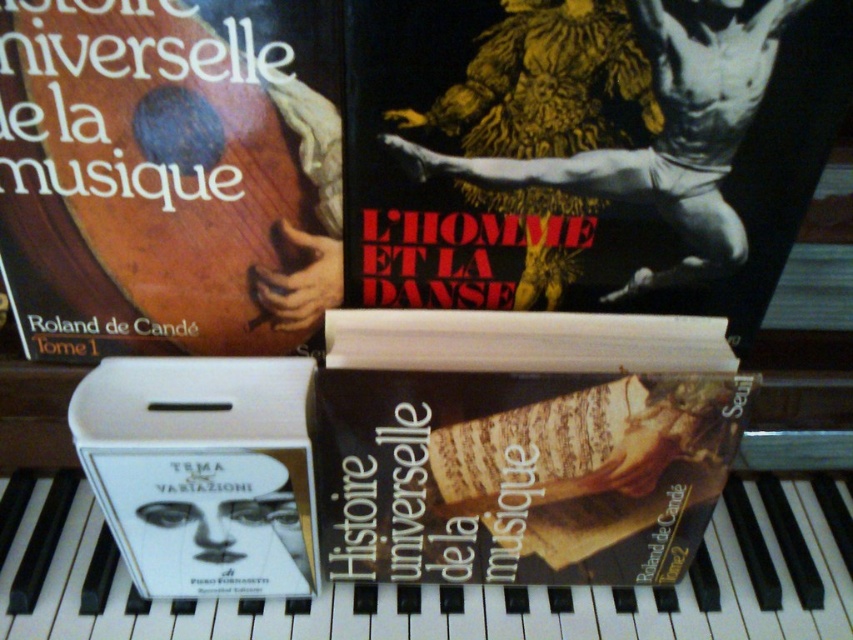
From the picture: Does wooden cover book at upper left have a lesser height compared to brown paperback book at center?

In fact, wooden cover book at upper left may be taller than brown paperback book at center.

Where is `wooden cover book at upper left`? The width and height of the screenshot is (853, 640). wooden cover book at upper left is located at coordinates (167, 173).

Is point (560, 422) positioned after point (56, 493)?

No, it is not.

Can you confirm if brown paperback book at center is thinner than white glossy piano keys at lower center?

Correct, brown paperback book at center's width is less than white glossy piano keys at lower center's.

Between point (358, 456) and point (488, 596), which one is positioned behind?

Positioned behind is point (488, 596).

Find the location of a particular element. brown paperback book at center is located at coordinates (519, 474).

I want to click on wooden cover book at upper left, so pyautogui.click(x=167, y=173).

Where is `wooden cover book at upper left`? Image resolution: width=853 pixels, height=640 pixels. wooden cover book at upper left is located at coordinates (167, 173).

What are the coordinates of `wooden cover book at upper left` in the screenshot? It's located at (167, 173).